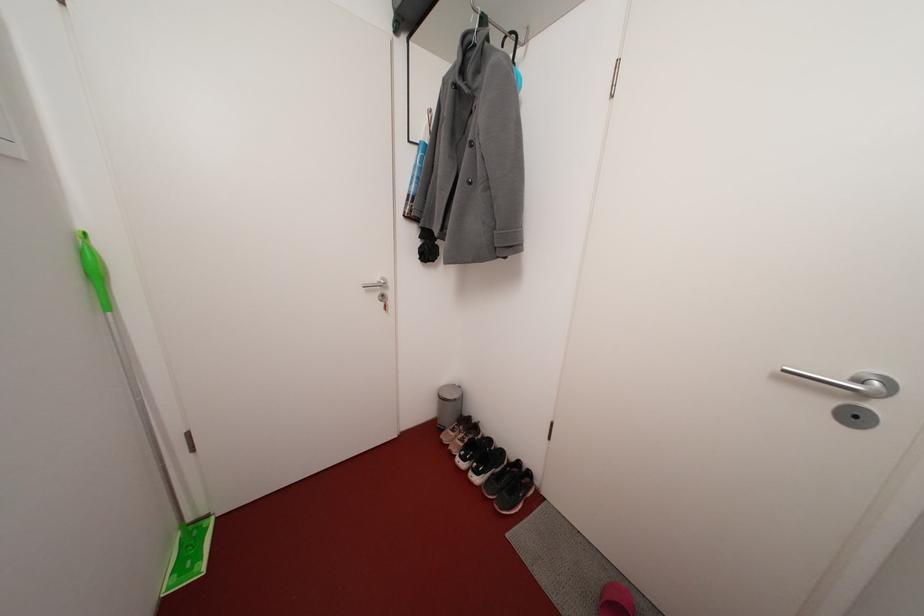
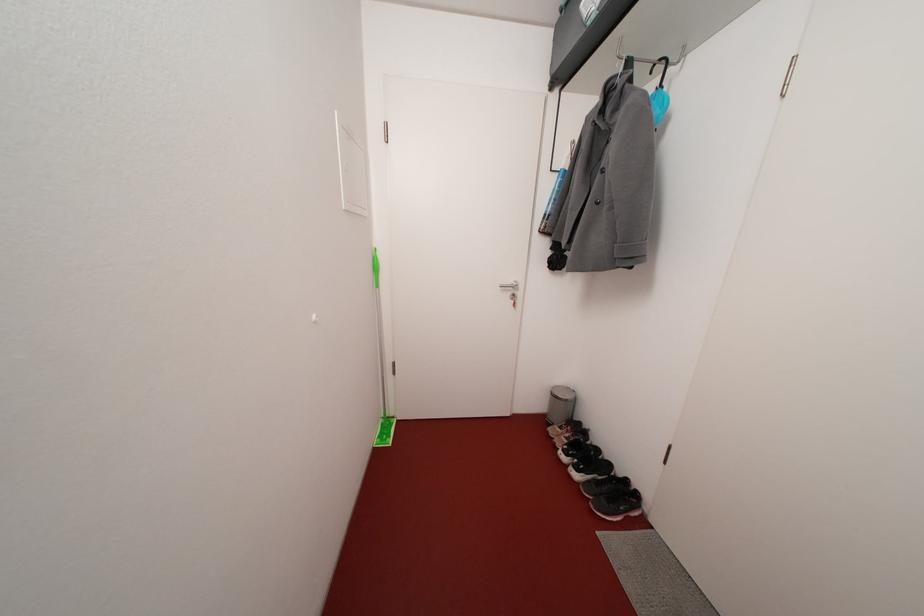
The point at (x=468, y=446) is marked in the first image. Where is the corresponding point in the second image?

(574, 444)